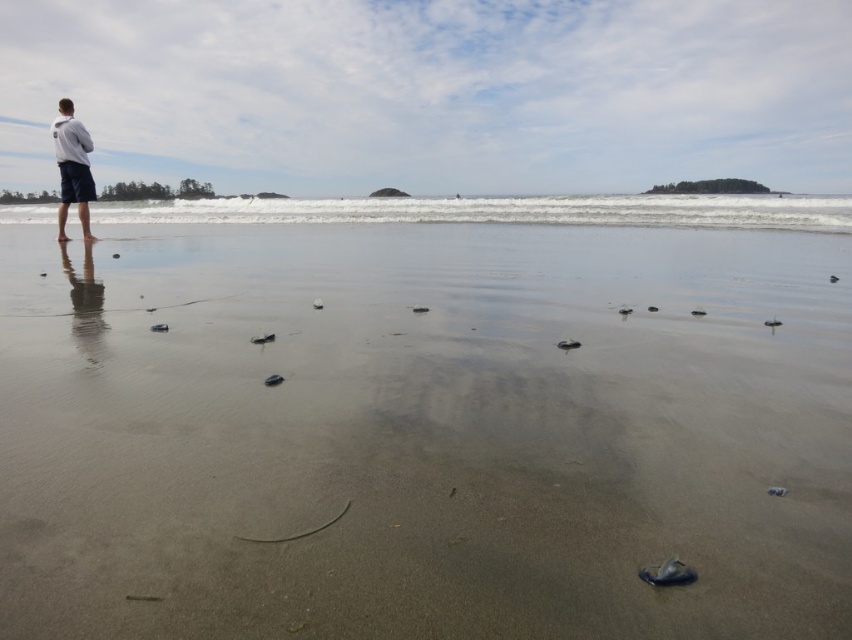
You are a photographer standing at the smooth sand at lower center and want to take a photo of the white matte jacket at upper left. You have a camera with a 5 meter range. Can you capture the jacket in your shot without moving?

The smooth sand at lower center and white matte jacket at upper left are 5.01 meters apart, so the distance is slightly beyond the camera range of 5 meters. Therefore, you cannot capture the jacket in your shot without moving closer.

You are a photographer trying to capture the entire beach scene in one shot. Given that the smooth sand at lower center and the white matte jacket at upper left are both in the frame, which object appears wider in the photo?

The smooth sand at lower center appears wider in the photo because its width surpasses that of the white matte jacket at upper left.

You are a photographer holding a camera that requires you to be at least 1.2 meters away from your subject to focus properly. You want to take a photo of the smooth sand at lower center. Can you focus on it from your current position?

The distance between the smooth sand at lower center and the camera is 1.18 meters, which is less than the required 1.2 meters for proper focus. Therefore, you cannot focus on the smooth sand at lower center from your current position.